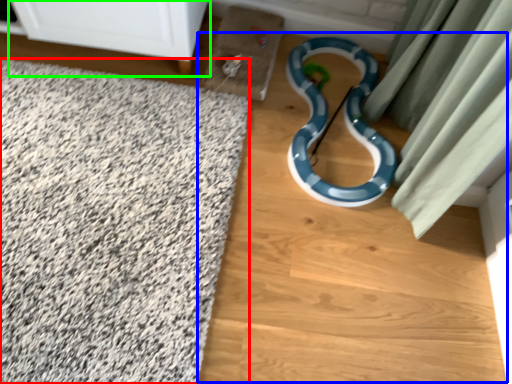
Question: Which object is the closest to the bath mat (highlighted by a red box)? Choose among these: dirt track (highlighted by a blue box) or furniture (highlighted by a green box).

Choices:
 (A) dirt track
 (B) furniture

Answer: (A)